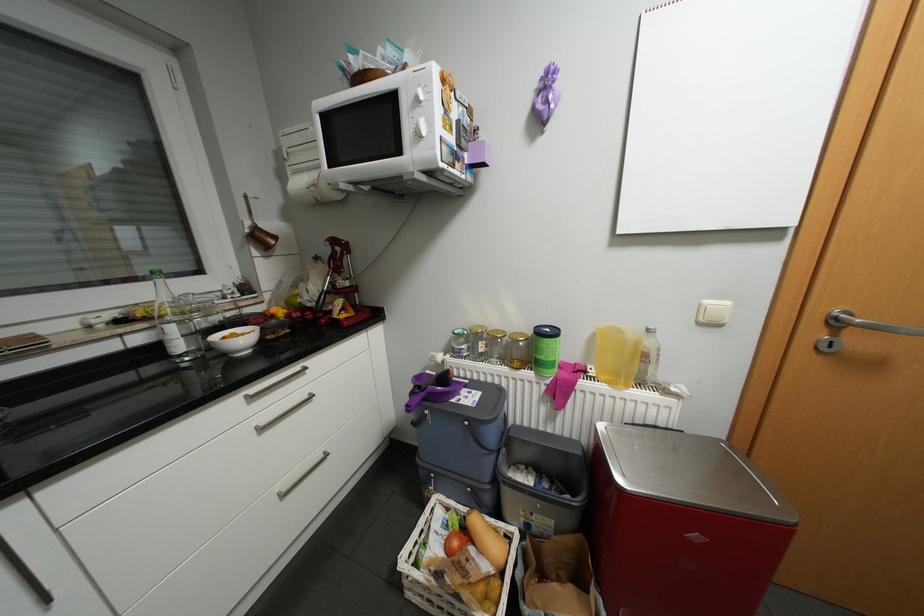
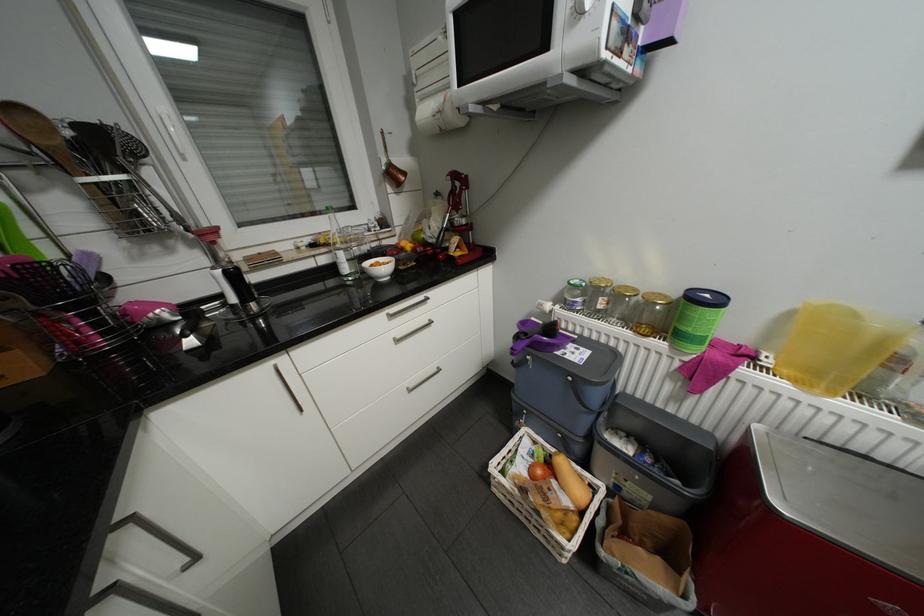
Which direction would the cameraman need to move to produce the second image?

The cameraman moved toward left, forward.